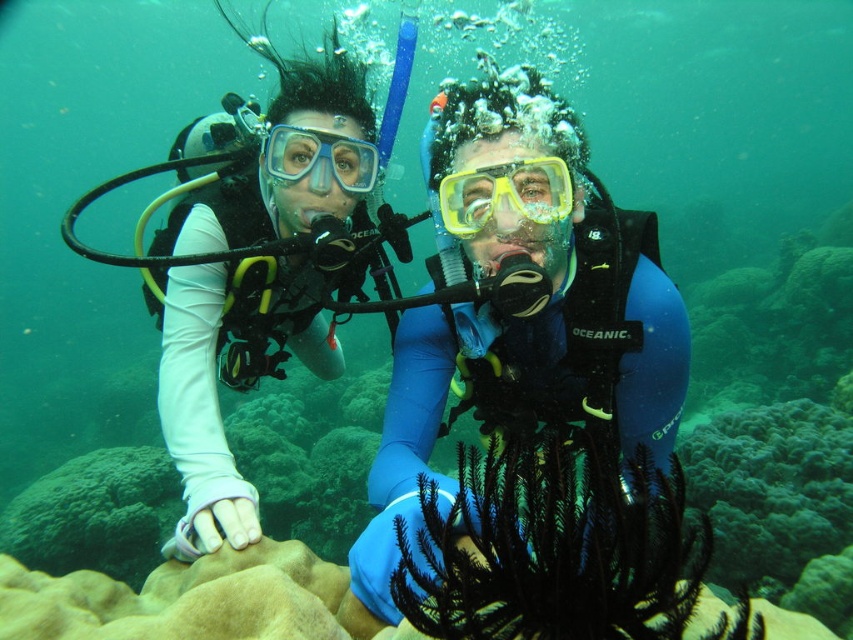
Who is more forward, (396, 477) or (376, 170)?

Positioned in front is point (396, 477).

Is blue rubber suit at center to the right of clear plastic goggles at upper center from the viewer's perspective?

Correct, you'll find blue rubber suit at center to the right of clear plastic goggles at upper center.

Locate an element on the screen. blue rubber suit at center is located at coordinates (524, 317).

Find the location of a particular element. This screenshot has width=853, height=640. blue rubber suit at center is located at coordinates point(524,317).

What do you see at coordinates (505, 195) in the screenshot? The image size is (853, 640). I see `yellow matte goggles at center` at bounding box center [505, 195].

Is point (550, 189) more distant than point (305, 148)?

No, it is not.

The width and height of the screenshot is (853, 640). Find the location of `yellow matte goggles at center`. yellow matte goggles at center is located at coordinates (505, 195).

Which is behind, point (469, 257) or point (194, 209)?

Positioned behind is point (194, 209).

Is blue rubber suit at center shorter than white matte diving suit at upper left?

Correct, blue rubber suit at center is not as tall as white matte diving suit at upper left.

I want to click on blue rubber suit at center, so click(524, 317).